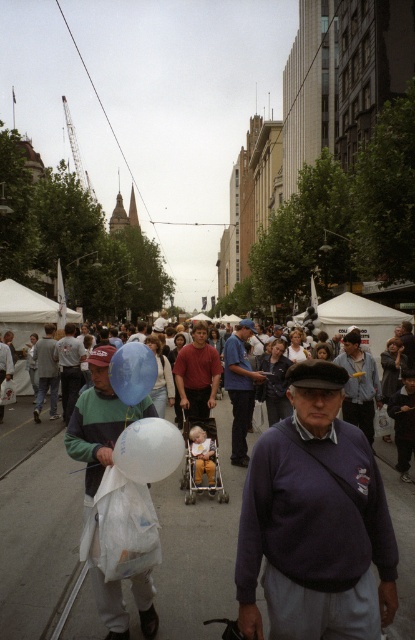
Image resolution: width=415 pixels, height=640 pixels. I want to click on translucent plastic bag at center, so click(100, 419).

Does point (78, 426) lie in front of point (190, 392)?

Yes.

At what (x,y) coordinates should I click in order to perform the action: click on translucent plastic bag at center. Please return your answer as a coordinate pair (x, y). Looking at the image, I should click on (100, 419).

Can you confirm if red cotton shirt at center is positioned below matte gray sweater at center?

Incorrect, red cotton shirt at center is not positioned below matte gray sweater at center.

Between point (178, 356) and point (63, 413), which one is positioned behind?

The point (63, 413) is more distant.

Find the location of a particular element. This screenshot has height=640, width=415. red cotton shirt at center is located at coordinates 197,374.

Locate an element on the screen. red cotton shirt at center is located at coordinates point(197,374).

Which of these two, blue denim jeans at center or denim jeans at center, stands shorter?

Standing shorter between the two is blue denim jeans at center.

Which is in front, point (239, 422) or point (48, 333)?

Positioned in front is point (239, 422).

In order to click on blue denim jeans at center in this screenshot , I will do tap(239, 387).